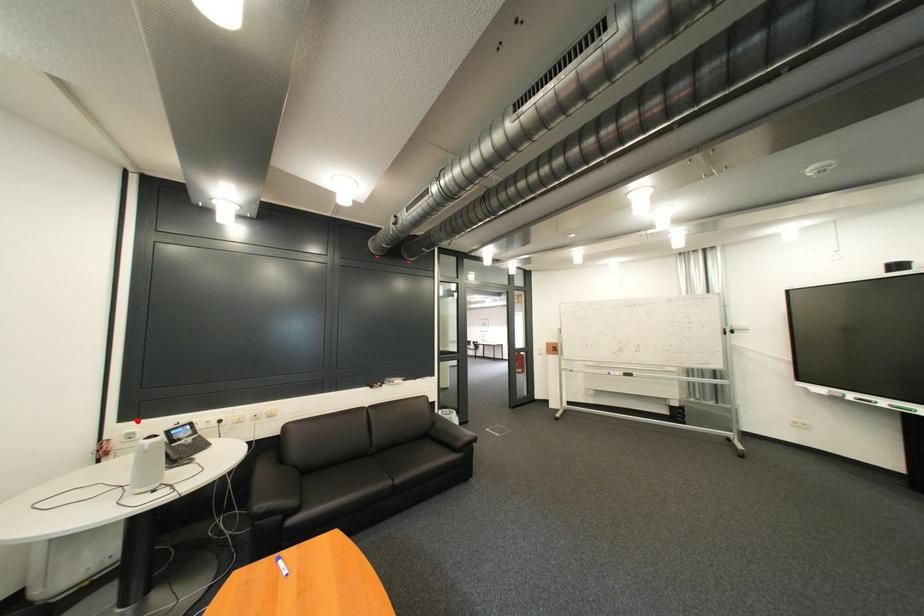
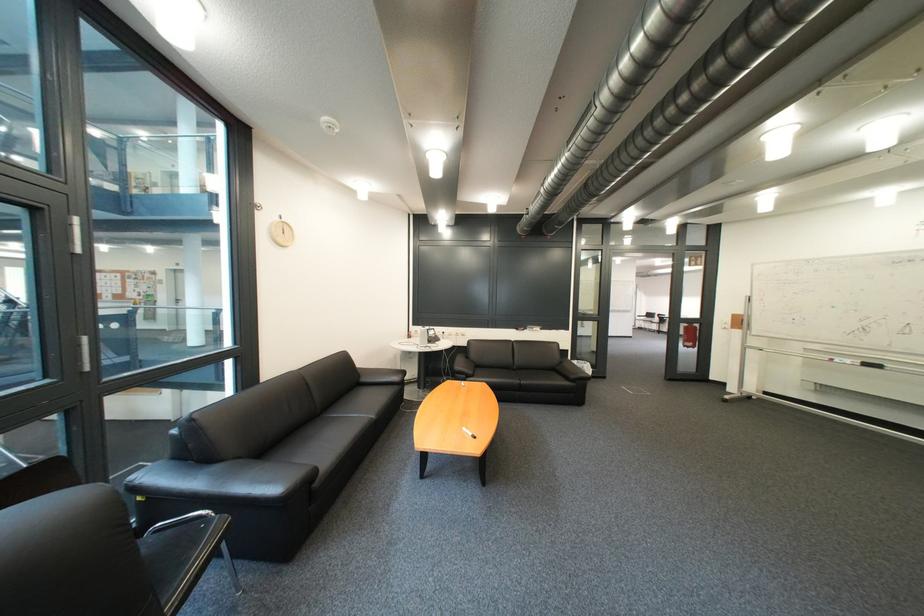
Find the pixel in the second image that matches the highlighted location in the first image.

(428, 326)